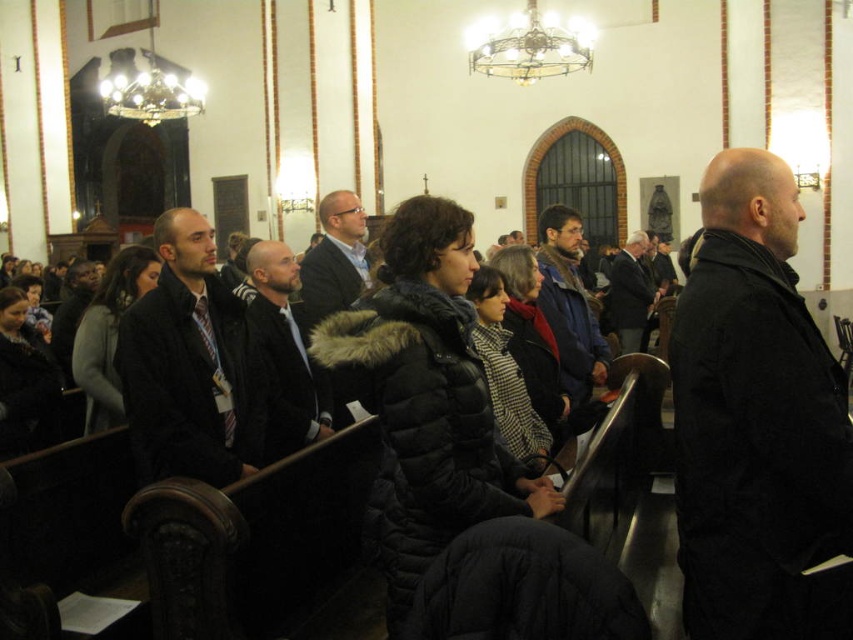
Question: Where is black quilted coat at right located in relation to dark blue jacket at center in the image?

Choices:
 (A) right
 (B) left

Answer: (B)

Question: Does dark gray jacket at center appear under matte black jacket at center?

Choices:
 (A) no
 (B) yes

Answer: (B)

Question: Based on their relative distances, which object is farther from the dark brown leather jacket at center?

Choices:
 (A) matte black jacket at center
 (B) black quilted coat at right
 (C) dark gray jacket at center

Answer: (B)

Question: Estimate the real-world distances between objects in this image. Which object is farther from the dark gray jacket at center?

Choices:
 (A) dark gray wool coat at center
 (B) dark blue jacket at center
 (C) dark brown leather jacket at center

Answer: (A)

Question: Can you confirm if dark blue jacket at center is positioned to the left of dark gray wool coat at center?

Choices:
 (A) yes
 (B) no

Answer: (A)

Question: Which object is positioned closest to the dark gray jacket at center?

Choices:
 (A) matte black jacket at center
 (B) dark brown leather jacket at center
 (C) black quilted coat at right

Answer: (B)